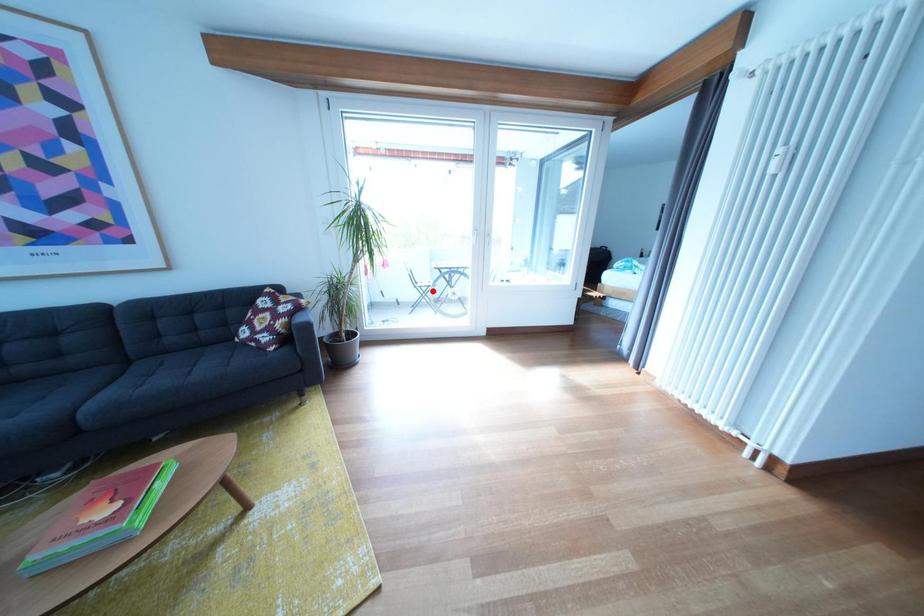
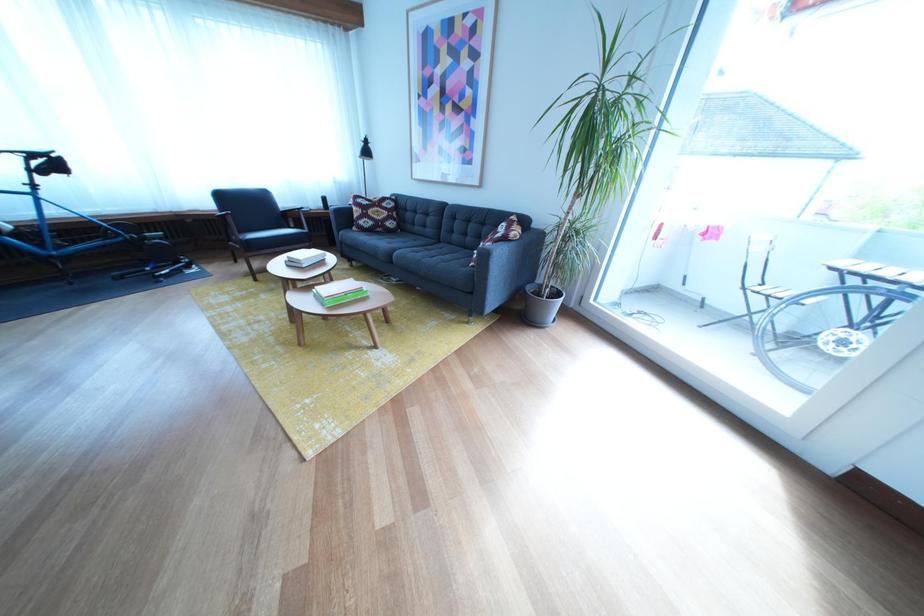
Question: I am providing you with two images of the same scene from different viewpoints. A red point is shown in image1. For the corresponding object point in image2, is it positioned nearer or farther from the camera?

Choices:
 (A) Nearer
 (B) Farther

Answer: (B)